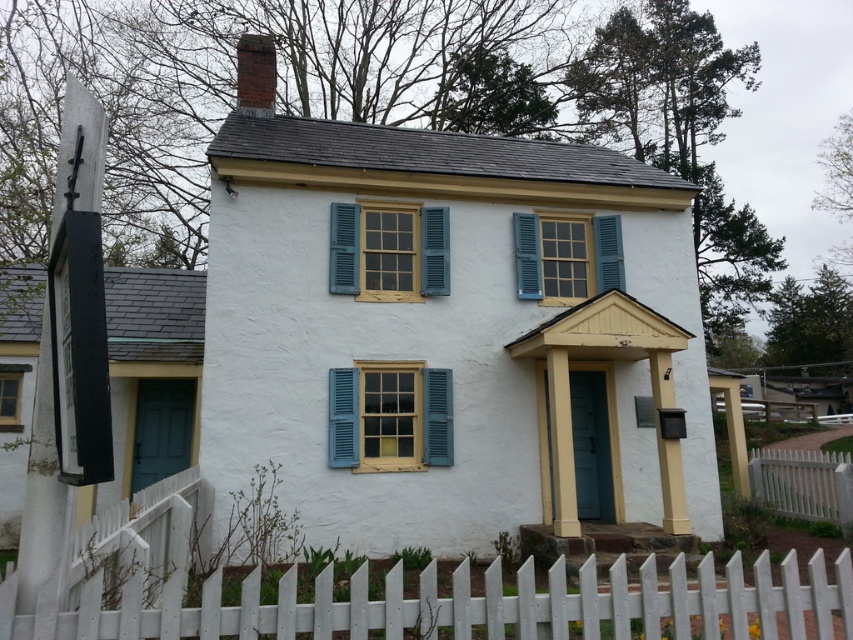
Question: Does white picket fence at lower center have a smaller size compared to blue painted wood window at upper center?

Choices:
 (A) no
 (B) yes

Answer: (A)

Question: Which of these objects is positioned farthest from the matte blue shutters at center?

Choices:
 (A) white picket fence at lower right
 (B) white picket fence at lower center
 (C) matte wooden window at left
 (D) blue painted wood window at upper center

Answer: (B)

Question: Which object is the farthest from the yellow wood window at center?

Choices:
 (A) blue painted wood window at upper center
 (B) white picket fence at lower center

Answer: (B)

Question: Is matte blue shutters at center wider than matte wooden window at left?

Choices:
 (A) yes
 (B) no

Answer: (A)

Question: Does white picket fence at lower right appear under matte wooden window at left?

Choices:
 (A) no
 (B) yes

Answer: (B)

Question: Which of the following is the closest to the observer?

Choices:
 (A) (343, 253)
 (B) (569, 257)
 (C) (187, 616)

Answer: (C)